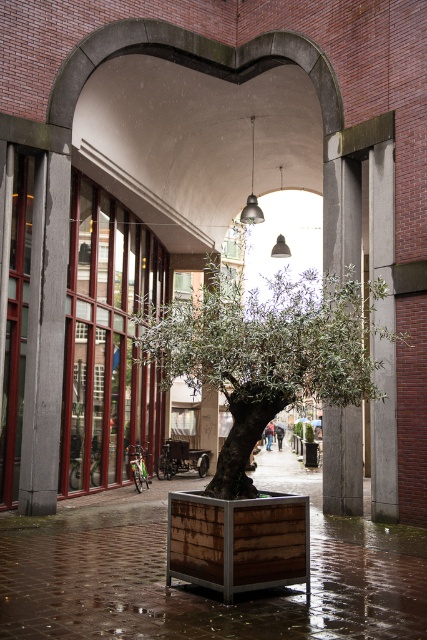
Question: Can you confirm if green leafy tree at center is bigger than wooden planter at center?

Choices:
 (A) no
 (B) yes

Answer: (B)

Question: Does green leafy tree at center come behind wooden planter at center?

Choices:
 (A) yes
 (B) no

Answer: (B)

Question: Which object is farther from the camera taking this photo?

Choices:
 (A) wooden planter at center
 (B) green leafy tree at center

Answer: (A)

Question: Which of the following is the closest to the observer?

Choices:
 (A) green leafy tree at center
 (B) wooden planter at center

Answer: (A)

Question: Is green leafy tree at center positioned at the back of wooden planter at center?

Choices:
 (A) no
 (B) yes

Answer: (A)